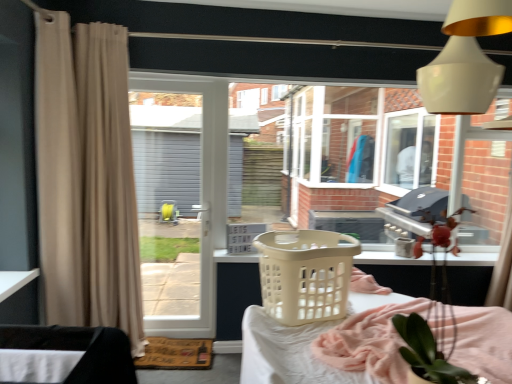
Question: Considering the relative positions of white plastic laundry basket at center, which is the 1th basket from back to front, and beige fabric curtain at left, which appears as the second curtain when viewed from the left, in the image provided, is white plastic laundry basket at center, which is the 1th basket from back to front, behind beige fabric curtain at left, which appears as the second curtain when viewed from the left,?

Choices:
 (A) yes
 (B) no

Answer: (A)

Question: Is white plastic laundry basket at center, positioned as the 2th basket in front-to-back order, next to beige fabric curtain at left, the 1th curtain when ordered from right to left, and touching it?

Choices:
 (A) no
 (B) yes

Answer: (A)

Question: Does white plastic laundry basket at center, positioned as the 2th basket in front-to-back order, turn towards beige fabric curtain at left, which appears as the second curtain when viewed from the left?

Choices:
 (A) no
 (B) yes

Answer: (A)

Question: Is white plastic laundry basket at center, which is the 1th basket from back to front, smaller than beige fabric curtain at left, the 1th curtain when ordered from right to left?

Choices:
 (A) yes
 (B) no

Answer: (A)

Question: Is white plastic laundry basket at center, which is the 1th basket from back to front, positioned with its back to beige fabric curtain at left, which appears as the second curtain when viewed from the left?

Choices:
 (A) no
 (B) yes

Answer: (A)

Question: In the image, is white glossy lampshade at upper right positioned in front of or behind beige fabric curtain at left, which appears as the second curtain when viewed from the left?

Choices:
 (A) front
 (B) behind

Answer: (A)

Question: In terms of size, does white glossy lampshade at upper right appear bigger or smaller than beige fabric curtain at left, which appears as the second curtain when viewed from the left?

Choices:
 (A) big
 (B) small

Answer: (B)

Question: From the image's perspective, is white glossy lampshade at upper right located above or below beige fabric curtain at left, which appears as the second curtain when viewed from the left?

Choices:
 (A) above
 (B) below

Answer: (A)

Question: From their relative heights in the image, would you say white glossy lampshade at upper right is taller or shorter than beige fabric curtain at left, the 1th curtain when ordered from right to left?

Choices:
 (A) short
 (B) tall

Answer: (A)

Question: Would you say white fabric at lower left is inside or outside beige fabric curtain at left, acting as the second curtain starting from the right?

Choices:
 (A) outside
 (B) inside

Answer: (A)

Question: From the image's perspective, is white fabric at lower left above or below beige fabric curtain at left, acting as the second curtain starting from the right?

Choices:
 (A) below
 (B) above

Answer: (A)

Question: Would you say white fabric at lower left is to the left or to the right of beige fabric curtain at left, acting as the second curtain starting from the right, in the picture?

Choices:
 (A) right
 (B) left

Answer: (A)

Question: In terms of width, does white fabric at lower left look wider or thinner when compared to beige fabric curtain at left, positioned as the first curtain in left-to-right order?

Choices:
 (A) thin
 (B) wide

Answer: (A)

Question: Does point (353, 246) appear closer or farther from the camera than point (495, 23)?

Choices:
 (A) closer
 (B) farther

Answer: (B)

Question: In terms of size, does beige plastic basket at center, placed as the 1th basket when sorted from front to back, appear bigger or smaller than white glossy lampshade at upper right?

Choices:
 (A) small
 (B) big

Answer: (A)